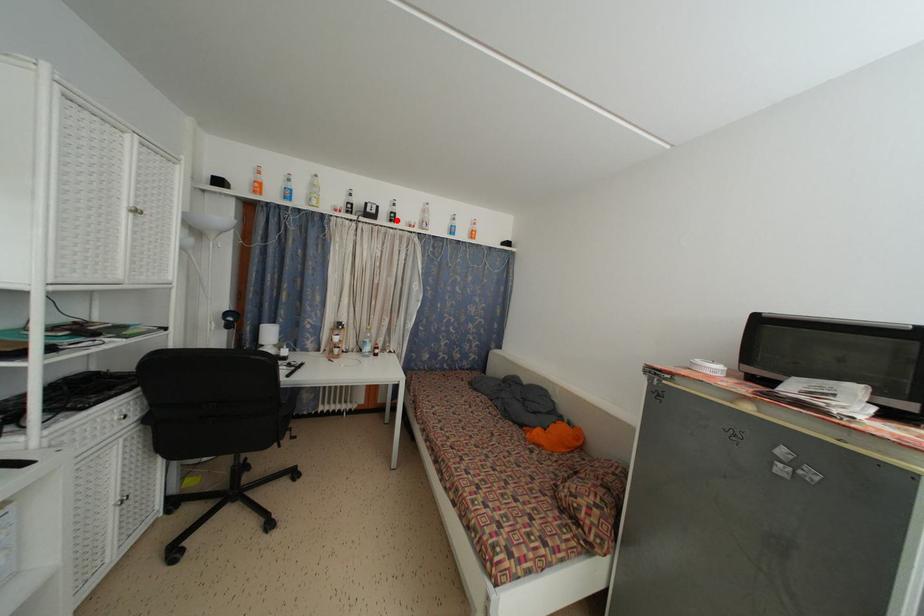
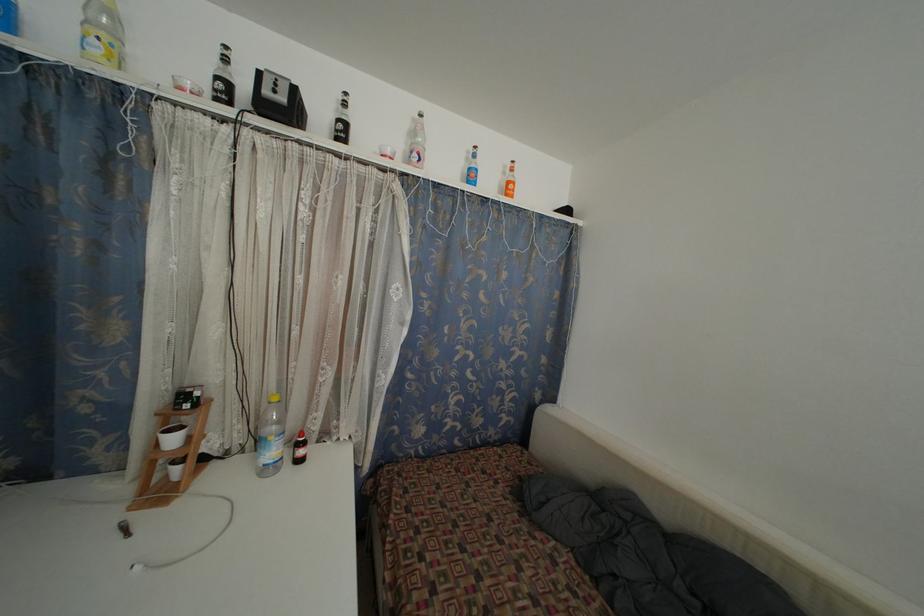
Where in the second image is the point corresponding to the highlighted location from the first image?

(345, 132)